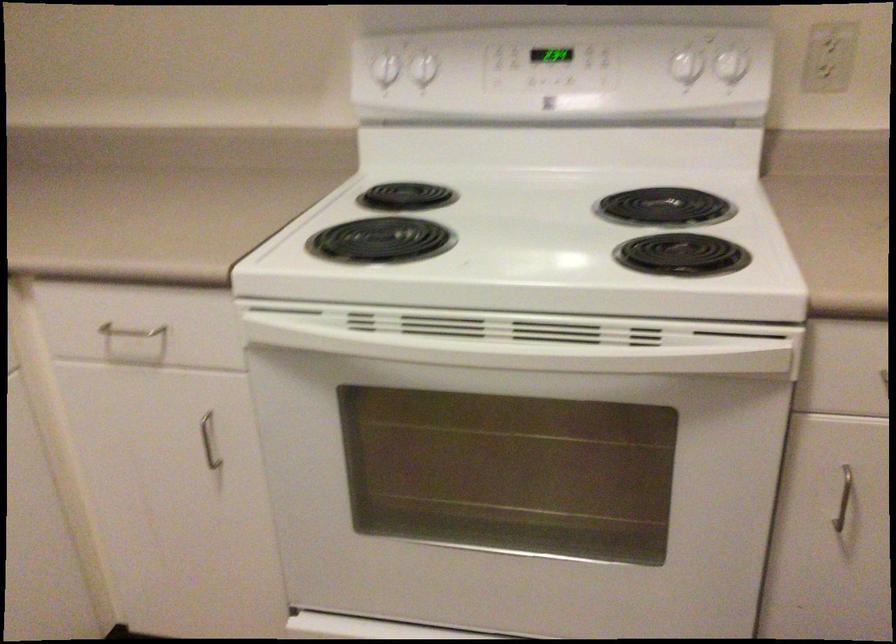
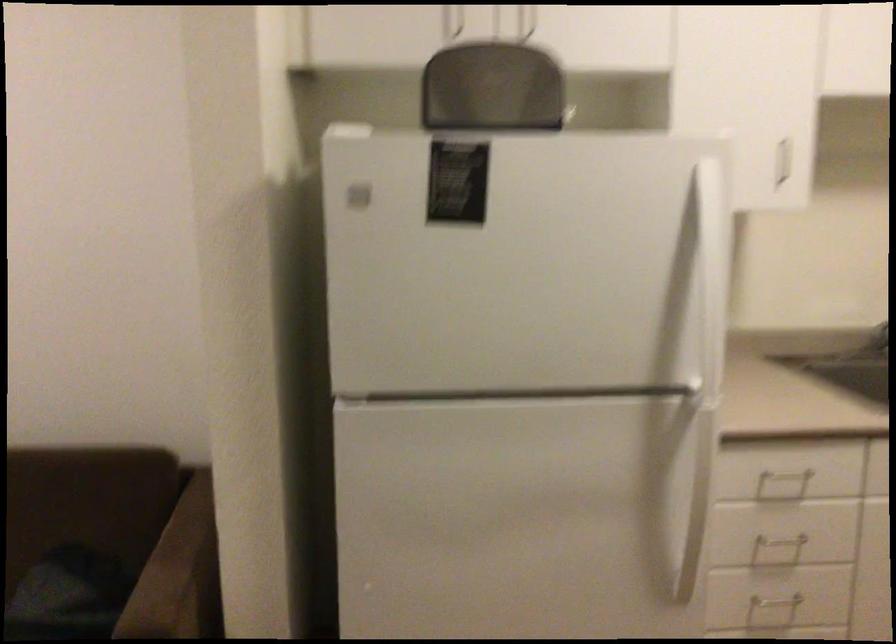
Question: The images are taken continuously from a first-person perspective. In which direction is your viewpoint rotating?

Choices:
 (A) Left
 (B) Right
 (C) Up
 (D) Down

Answer: (A)